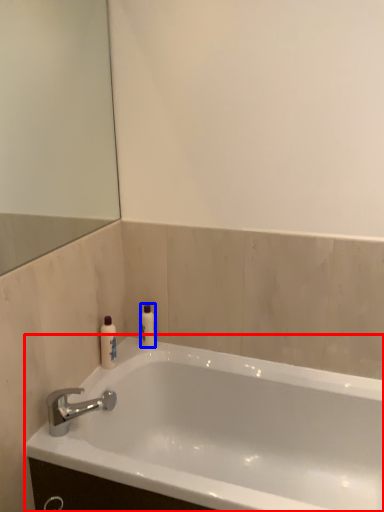
Question: Which of the following is the closest to the observer, bathtub (highlighted by a red box) or toiletry (highlighted by a blue box)?

Choices:
 (A) bathtub
 (B) toiletry

Answer: (A)